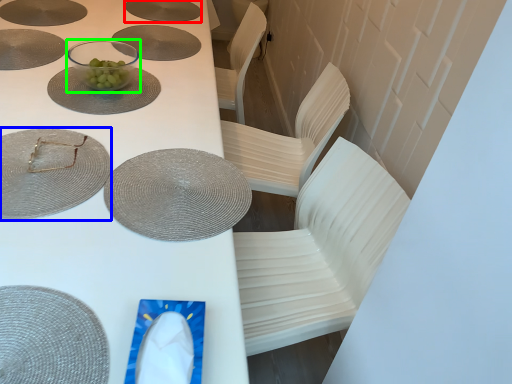
Question: Considering the real-world distances, which object is closest to platter (highlighted by a red box)? glass plate (highlighted by a blue box) or tableware (highlighted by a green box).

Choices:
 (A) glass plate
 (B) tableware

Answer: (B)